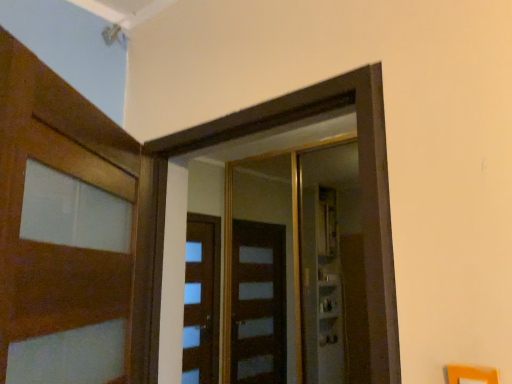
Measure the distance between point [283,165] and camera.

Point [283,165] is 4.30 meters from camera.

The width and height of the screenshot is (512, 384). Find the location of `wooden door at left`. wooden door at left is located at coordinates (63, 230).

What are the coordinates of `wooden door at center, the second elevator viewed from the back` in the screenshot? It's located at (360, 179).

The width and height of the screenshot is (512, 384). Identify the location of transparent glass elevator at center, the 2th elevator from the front. (290, 268).

Could transparent glass elevator at center, the 2th elevator from the front, be considered to be inside wooden door at center, placed as the 1th elevator when sorted from front to back?

No, transparent glass elevator at center, the 2th elevator from the front, is located outside of wooden door at center, placed as the 1th elevator when sorted from front to back.

From a real-world perspective, does wooden door at center, the second elevator viewed from the back, stand above transparent glass elevator at center, the 1th elevator when ordered from back to front?

Actually, wooden door at center, the second elevator viewed from the back, is physically below transparent glass elevator at center, the 1th elevator when ordered from back to front, in the real world.

Considering the positions of objects wooden door at center, the second elevator viewed from the back, and transparent glass elevator at center, the 1th elevator when ordered from back to front, in the image provided, who is more to the left, wooden door at center, the second elevator viewed from the back, or transparent glass elevator at center, the 1th elevator when ordered from back to front,?

wooden door at center, the second elevator viewed from the back, is more to the left.

From a real-world perspective, is transparent glass elevator at center, the 1th elevator when ordered from back to front, below wooden door at left?

Incorrect, from a real-world perspective, transparent glass elevator at center, the 1th elevator when ordered from back to front, is higher than wooden door at left.

Could you tell me if transparent glass elevator at center, the 2th elevator from the front, is turned towards wooden door at left?

Yes, transparent glass elevator at center, the 2th elevator from the front, is oriented towards wooden door at left.

Who is bigger, transparent glass elevator at center, the 2th elevator from the front, or wooden door at left?

transparent glass elevator at center, the 2th elevator from the front.

Is transparent glass elevator at center, the 2th elevator from the front, completely or partially outside of wooden door at left?

Yes, transparent glass elevator at center, the 2th elevator from the front, is not within wooden door at left.

Could you tell me if wooden door at left is turned towards wooden door at center, placed as the 1th elevator when sorted from front to back?

Yes, wooden door at left is facing wooden door at center, placed as the 1th elevator when sorted from front to back.

Is point (3, 261) closer to viewer compared to point (207, 127)?

Yes, point (3, 261) is closer to viewer.

Would you say wooden door at left is inside or outside wooden door at center, the second elevator viewed from the back?

The correct answer is: outside.

In the image, is wooden door at left on the left side or the right side of wooden door at center, the second elevator viewed from the back?

Based on their positions, wooden door at left is located to the left of wooden door at center, the second elevator viewed from the back.

Considering the relative sizes of wooden door at center, the second elevator viewed from the back, and wooden door at left in the image provided, is wooden door at center, the second elevator viewed from the back, wider than wooden door at left?

No.

Are wooden door at center, placed as the 1th elevator when sorted from front to back, and wooden door at left located far from each other?

wooden door at center, placed as the 1th elevator when sorted from front to back, is near wooden door at left, not far away.

From a real-world perspective, which is physically below, wooden door at center, placed as the 1th elevator when sorted from front to back, or wooden door at left?

wooden door at left, from a real-world perspective.

Considering the positions of points (273, 368) and (193, 145), is point (273, 368) farther from camera compared to point (193, 145)?

Yes, point (273, 368) is farther from viewer.

Considering the relative sizes of transparent glass elevator at center, the 2th elevator from the front, and wooden door at center, placed as the 1th elevator when sorted from front to back, in the image provided, is transparent glass elevator at center, the 2th elevator from the front, wider than wooden door at center, placed as the 1th elevator when sorted from front to back,?

No, transparent glass elevator at center, the 2th elevator from the front, is not wider than wooden door at center, placed as the 1th elevator when sorted from front to back.

Is transparent glass elevator at center, the 1th elevator when ordered from back to front, situated inside wooden door at center, placed as the 1th elevator when sorted from front to back, or outside?

transparent glass elevator at center, the 1th elevator when ordered from back to front, is spatially situated outside wooden door at center, placed as the 1th elevator when sorted from front to back.

Between transparent glass elevator at center, the 2th elevator from the front, and wooden door at center, the second elevator viewed from the back, which one has more height?

transparent glass elevator at center, the 2th elevator from the front.

From their relative heights in the image, would you say wooden door at left is taller or shorter than transparent glass elevator at center, the 1th elevator when ordered from back to front?

Considering their sizes, wooden door at left has less height than transparent glass elevator at center, the 1th elevator when ordered from back to front.

Can you tell me how much wooden door at left and transparent glass elevator at center, the 2th elevator from the front, differ in facing direction?

124 degrees separate the facing orientations of wooden door at left and transparent glass elevator at center, the 2th elevator from the front.

Does wooden door at left appear on the left side of transparent glass elevator at center, the 1th elevator when ordered from back to front?

Yes.

Find the location of a particular element. The width and height of the screenshot is (512, 384). elevator below the transparent glass elevator at center, the 2th elevator from the front (from a real-world perspective) is located at coordinates (360, 179).

Locate an element on the screen. The height and width of the screenshot is (384, 512). door in front of the transparent glass elevator at center, the 2th elevator from the front is located at coordinates (63, 230).

From the image, which object appears to be farther from wooden door at left, wooden door at center, the second elevator viewed from the back, or transparent glass elevator at center, the 2th elevator from the front?

Based on the image, transparent glass elevator at center, the 2th elevator from the front, appears to be further to wooden door at left.

Looking at the image, which one is located closer to transparent glass elevator at center, the 1th elevator when ordered from back to front, wooden door at center, the second elevator viewed from the back, or wooden door at left?

Among the two, wooden door at center, the second elevator viewed from the back, is located nearer to transparent glass elevator at center, the 1th elevator when ordered from back to front.

From the image, which object appears to be farther from wooden door at left, transparent glass elevator at center, the 2th elevator from the front, or wooden door at center, placed as the 1th elevator when sorted from front to back?

Based on the image, transparent glass elevator at center, the 2th elevator from the front, appears to be further to wooden door at left.

Based on their spatial positions, is wooden door at left or wooden door at center, the second elevator viewed from the back, closer to transparent glass elevator at center, the 1th elevator when ordered from back to front?

wooden door at center, the second elevator viewed from the back.

Considering their positions, is transparent glass elevator at center, the 1th elevator when ordered from back to front, positioned closer to wooden door at center, placed as the 1th elevator when sorted from front to back, than wooden door at left?

wooden door at left lies closer to wooden door at center, placed as the 1th elevator when sorted from front to back, than the other object.

From the image, which object appears to be farther from wooden door at center, placed as the 1th elevator when sorted from front to back, wooden door at left or transparent glass elevator at center, the 2th elevator from the front?

transparent glass elevator at center, the 2th elevator from the front, is further to wooden door at center, placed as the 1th elevator when sorted from front to back.

The image size is (512, 384). Find the location of `elevator between wooden door at left and transparent glass elevator at center, the 2th elevator from the front, from front to back`. elevator between wooden door at left and transparent glass elevator at center, the 2th elevator from the front, from front to back is located at coordinates [x=360, y=179].